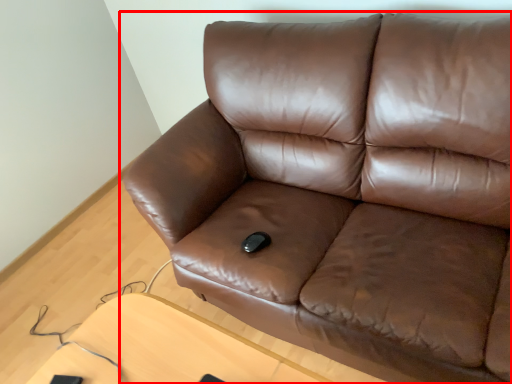
Question: Considering the relative positions of studio couch (annotated by the red box) and table in the image provided, where is studio couch (annotated by the red box) located with respect to the staircase?

Choices:
 (A) left
 (B) right

Answer: (B)